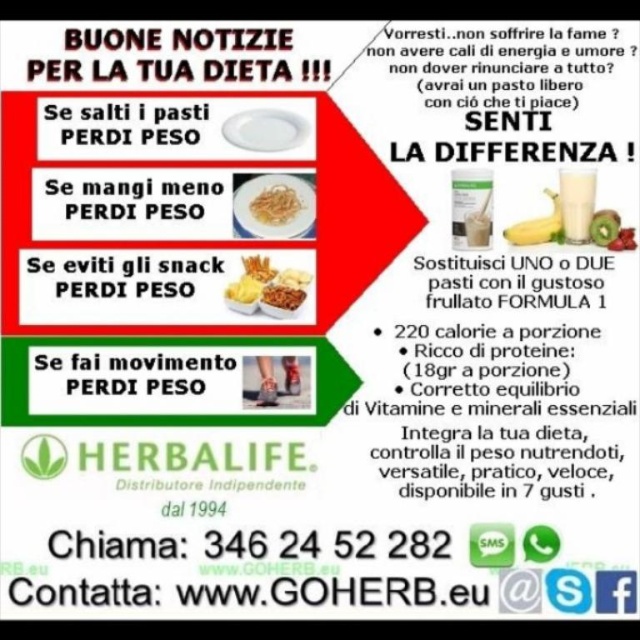
Can you confirm if white creamy milkshake at right is positioned above green matte kiwi at center?

Yes, white creamy milkshake at right is above green matte kiwi at center.

How distant is white creamy milkshake at right from green matte kiwi at center?

white creamy milkshake at right and green matte kiwi at center are 2.71 inches apart.

Which is behind, point (588, 220) or point (616, 236)?

Positioned behind is point (588, 220).

Identify the location of white creamy milkshake at right. Image resolution: width=640 pixels, height=640 pixels. (577, 202).

Who is more distant from viewer, (572,198) or (269,294)?

The point (269,294) is more distant.

The width and height of the screenshot is (640, 640). I want to click on white creamy milkshake at right, so click(577, 202).

Between shiny plastic snacks at center and yellow crumbly snack at center, which one has more height?

shiny plastic snacks at center is taller.

Who is positioned more to the right, shiny plastic snacks at center or yellow crumbly snack at center?

Positioned to the right is yellow crumbly snack at center.

Who is more forward, (230, 289) or (296, 304)?

Point (230, 289) is more forward.

I want to click on shiny plastic snacks at center, so click(266, 289).